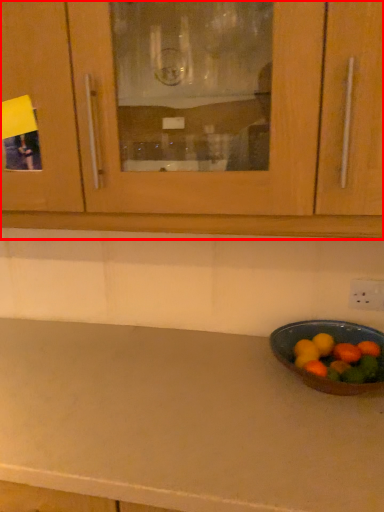
Question: Where is cabinetry (annotated by the red box) located in relation to fruit in the image?

Choices:
 (A) left
 (B) right

Answer: (A)